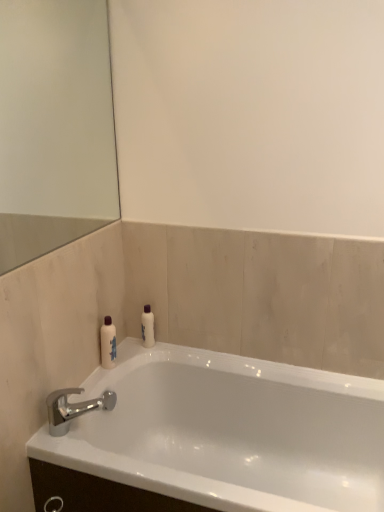
The width and height of the screenshot is (384, 512). In order to click on unoccupied region to the right of white glossy bottle at left, which appears as the 1th toiletry when viewed from the front in this screenshot , I will do `click(143, 357)`.